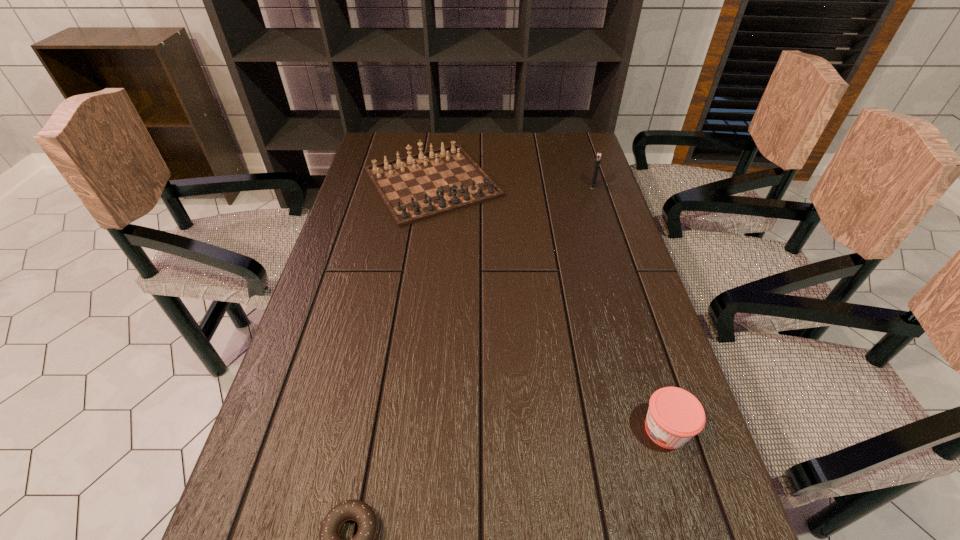
At what (x,y) coordinates should I click in order to perform the action: click on free space between the chessboard and the third farthest object. Please return your answer as a coordinate pair (x, y). The height and width of the screenshot is (540, 960). Looking at the image, I should click on (549, 306).

Locate an element on the screen. vacant space that's between the third farthest object and the igniter is located at coordinates (630, 308).

This screenshot has height=540, width=960. I want to click on the second closest object to the chessboard, so click(674, 416).

You are a GUI agent. You are given a task and a screenshot of the screen. Output one action in this format:
    pyautogui.click(x=<x>, y=<y>)
    Task: Click on the object that is the second closest to the doughnut
    The width and height of the screenshot is (960, 540).
    Given the screenshot: What is the action you would take?
    pyautogui.click(x=414, y=188)

You are a GUI agent. You are given a task and a screenshot of the screen. Output one action in this format:
    pyautogui.click(x=<x>, y=<y>)
    Task: Click on the vacant space that satisfies the following two spatial constraints: 1. on the front side of the igniter; 2. on the front label of the jam
    This screenshot has height=540, width=960.
    Given the screenshot: What is the action you would take?
    pyautogui.click(x=671, y=429)

Locate an element on the screen. This screenshot has width=960, height=540. free point that satisfies the following two spatial constraints: 1. on the front side of the chessboard; 2. on the right side of the igniter is located at coordinates (432, 186).